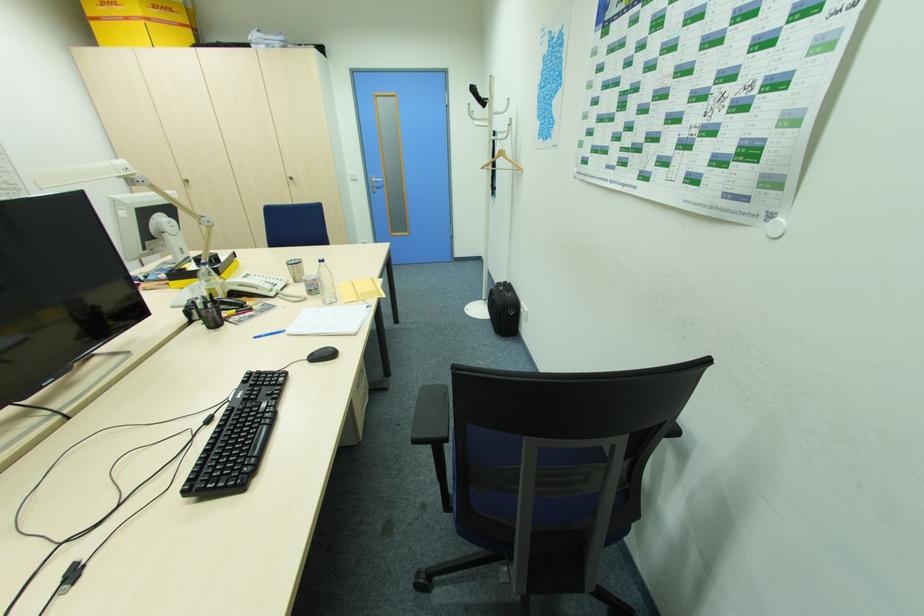
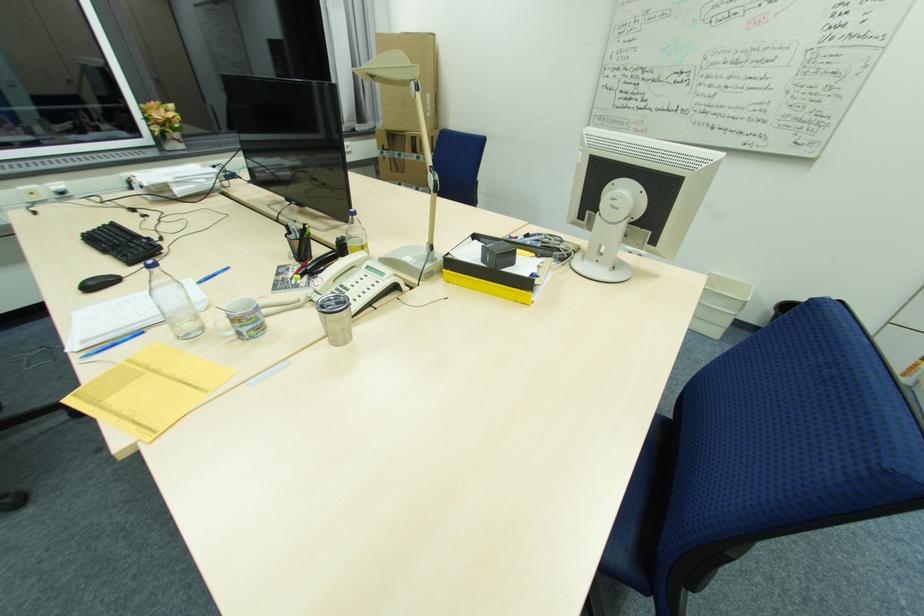
Find the pixel in the second image that matches [324,264] in the first image.

(157, 270)